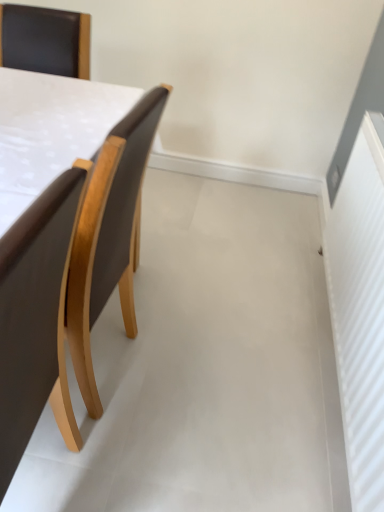
Question: From the image's perspective, is brown leather chair at left, which ranks as the 1th chair in front-to-back order, above or below brown leather chair at left, which ranks as the first chair in back-to-front order?

Choices:
 (A) above
 (B) below

Answer: (B)

Question: Considering the positions of brown leather chair at left, the 2th chair from the back, and brown leather chair at left, marked as the 2th chair in a front-to-back arrangement, in the image, is brown leather chair at left, the 2th chair from the back, bigger or smaller than brown leather chair at left, marked as the 2th chair in a front-to-back arrangement,?

Choices:
 (A) big
 (B) small

Answer: (B)

Question: In the image, is brown leather chair at left, the 2th chair from the back, positioned in front of or behind brown leather chair at left, which ranks as the first chair in back-to-front order?

Choices:
 (A) behind
 (B) front

Answer: (B)

Question: From their relative heights in the image, would you say brown leather chair at left, marked as the 2th chair in a front-to-back arrangement, is taller or shorter than brown leather chair at left, which ranks as the 1th chair in front-to-back order?

Choices:
 (A) short
 (B) tall

Answer: (A)

Question: In terms of size, does brown leather chair at left, which ranks as the first chair in back-to-front order, appear bigger or smaller than brown leather chair at left, the 2th chair from the back?

Choices:
 (A) small
 (B) big

Answer: (B)

Question: Is point (64, 306) positioned closer to the camera than point (29, 305)?

Choices:
 (A) farther
 (B) closer

Answer: (A)

Question: Relative to brown leather chair at left, the 2th chair from the back, is brown leather chair at left, which ranks as the first chair in back-to-front order, in front or behind?

Choices:
 (A) front
 (B) behind

Answer: (B)